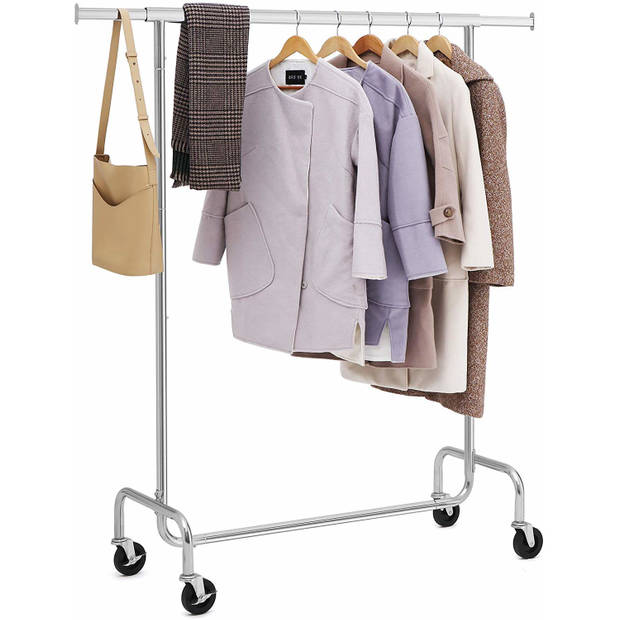
Find the location of a particular element. hangers is located at coordinates (297, 45), (335, 45), (372, 43), (408, 43), (444, 46).